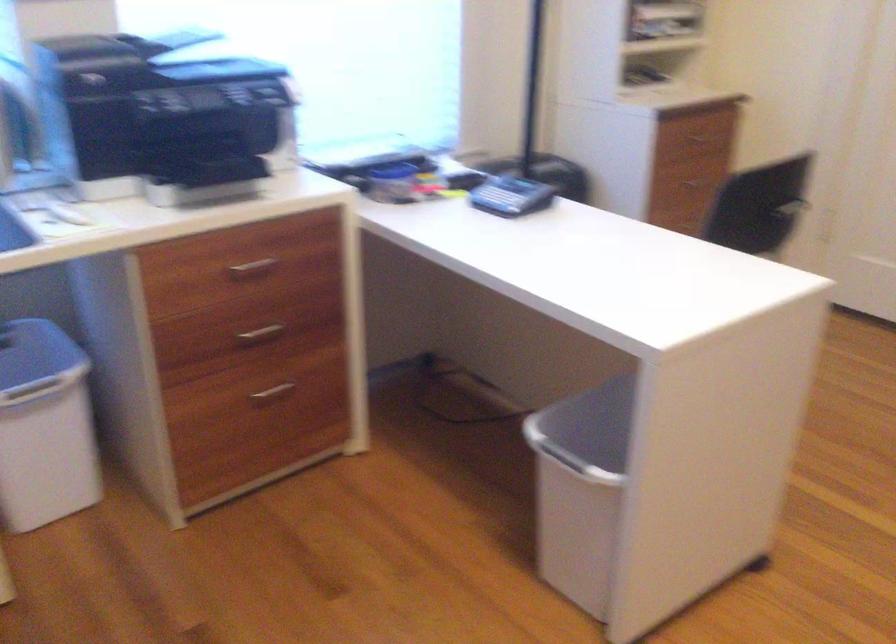
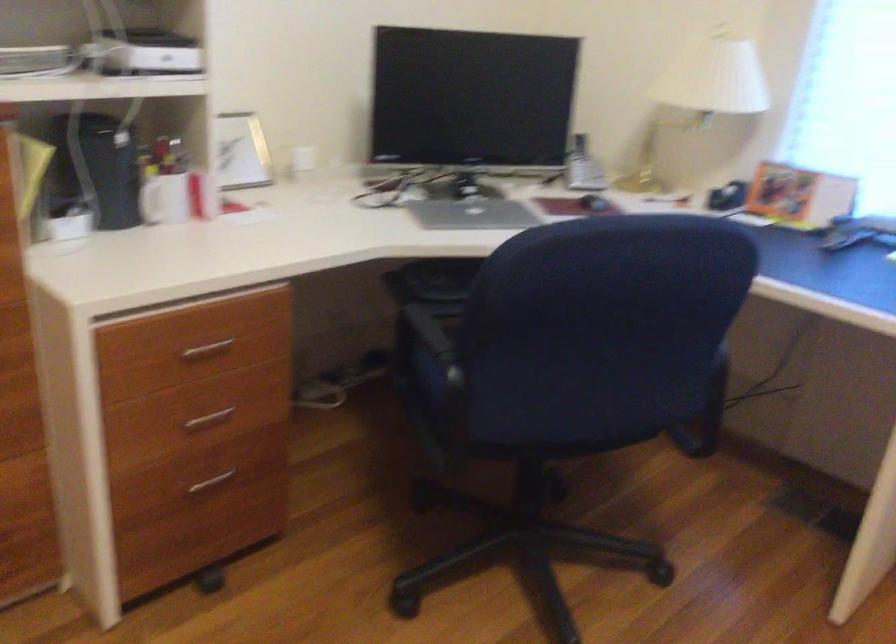
Based on the photo, based on the continuous images, in which direction is the camera rotating?

The camera's rotation is toward left-down.